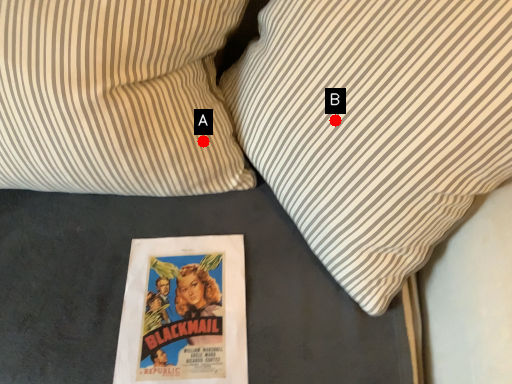
Question: Two points are circled on the image, labeled by A and B beside each circle. Which of the following is the closest to the observer?

Choices:
 (A) A is closer
 (B) B is closer

Answer: (B)